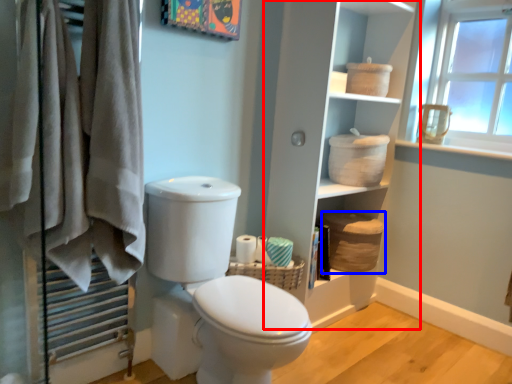
Question: Which object is closer to the camera taking this photo, bookshelf (highlighted by a red box) or basket (highlighted by a blue box)?

Choices:
 (A) bookshelf
 (B) basket

Answer: (A)